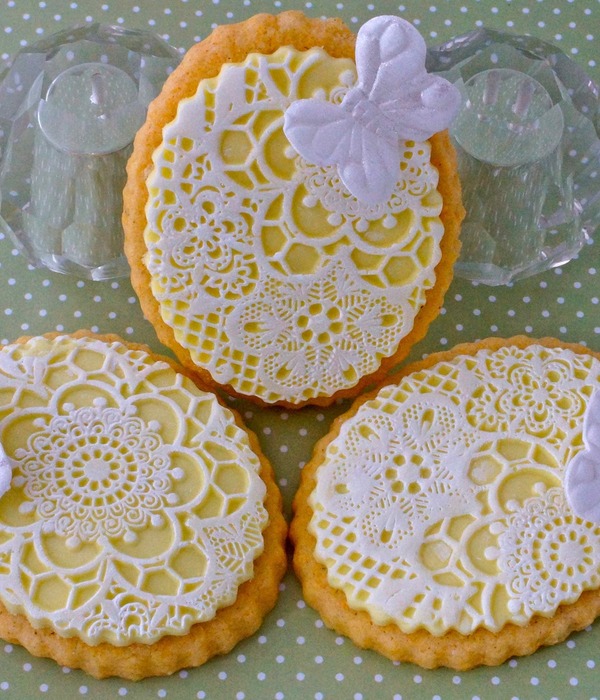
In order to click on table cloth in this screenshot , I will do `click(290, 666)`.